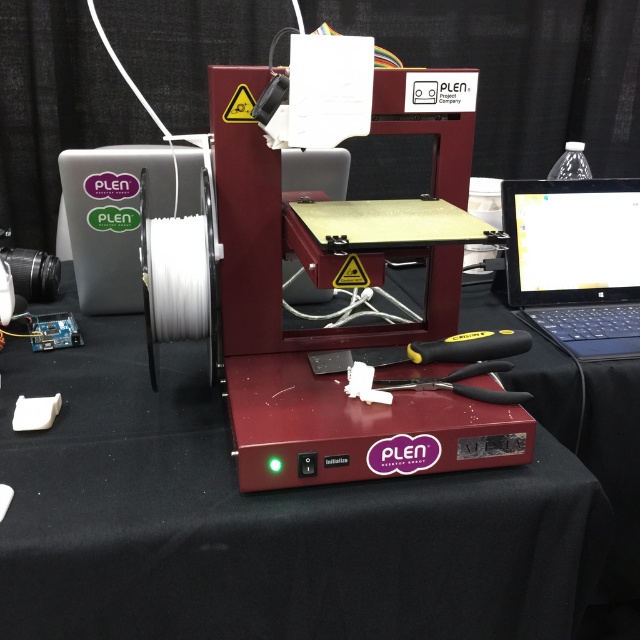
You are standing 3.73 feet away from the black plastic laptop at upper right. If you want to reach it without moving your feet, can you do so comfortably?

The black plastic laptop at upper right is 3.73 feet away from the viewer. Since this distance is relatively far for comfortable arm reach, you might need to move closer to grab it comfortably.

You are standing in front of the 3D printer setup. There is a point at coordinates (x=576, y=260). Which object is located at that point?

The point at coordinates (x=576, y=260) is located on the black plastic laptop at upper right.

You are a technician examining the 3D printer setup. You need to access both the matte red printer at center and the black plastic laptop at upper right. Which object is closer to you, and would you need to move closer or further to reach the other?

The matte red printer at center is closer to the viewer. To reach the black plastic laptop at upper right, you would need to move further away from your current position.